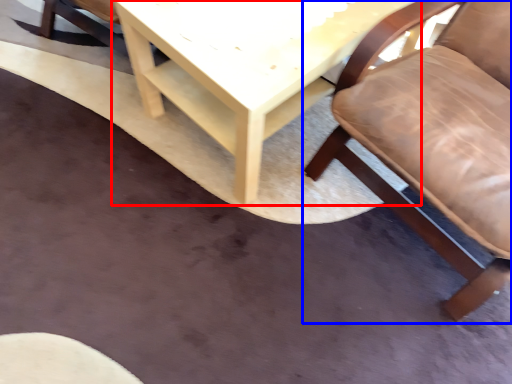
Question: Which of the following is the farthest to the observer, table (highlighted by a red box) or chair (highlighted by a blue box)?

Choices:
 (A) table
 (B) chair

Answer: (A)